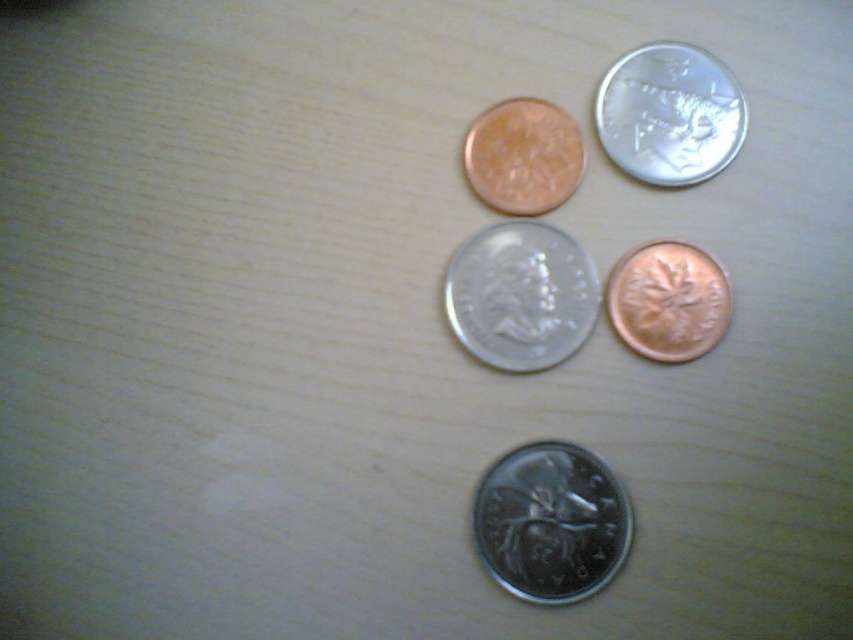
Who is positioned more to the left, silver metallic coin at center or matte copper coin at upper center?

Positioned to the left is matte copper coin at upper center.

Between silver metallic coin at center and matte copper coin at upper center, which one is positioned lower?

Positioned lower is silver metallic coin at center.

Identify the location of silver metallic coin at center. The height and width of the screenshot is (640, 853). (550, 522).

Is copper metallic coin at center-right below matte copper coin at upper center?

Yes, copper metallic coin at center-right is below matte copper coin at upper center.

Between copper metallic coin at center-right and matte copper coin at upper center, which one has less height?

matte copper coin at upper center is shorter.

Is point (699, 348) farther from viewer compared to point (534, 113)?

No, (699, 348) is closer to viewer.

Find the location of `copper metallic coin at center-right`. copper metallic coin at center-right is located at coordinates click(668, 301).

Does silver/metallic coin at upper right have a lesser width compared to copper metallic coin at center-right?

Incorrect, silver/metallic coin at upper right's width is not less than copper metallic coin at center-right's.

Who is positioned more to the left, silver/metallic coin at upper right or copper metallic coin at center-right?

From the viewer's perspective, copper metallic coin at center-right appears more on the left side.

You are a GUI agent. You are given a task and a screenshot of the screen. Output one action in this format:
    pyautogui.click(x=<x>, y=<y>)
    Task: Click on the silver/metallic coin at upper right
    This screenshot has height=640, width=853.
    Given the screenshot: What is the action you would take?
    pyautogui.click(x=669, y=115)

What are the coordinates of `silver/metallic coin at upper right` in the screenshot? It's located at (669, 115).